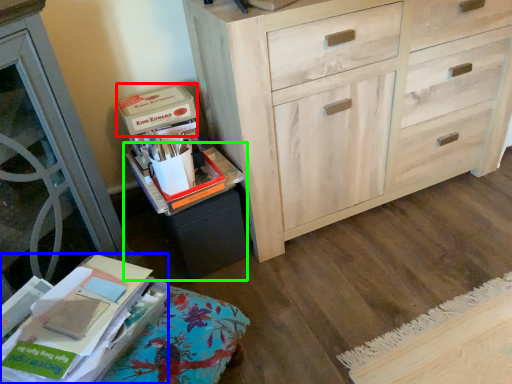
Question: Based on their relative distances, which object is farther from storage box (highlighted by a red box)? Choose from paperback book (highlighted by a blue box) and cabinetry (highlighted by a green box).

Choices:
 (A) paperback book
 (B) cabinetry

Answer: (A)